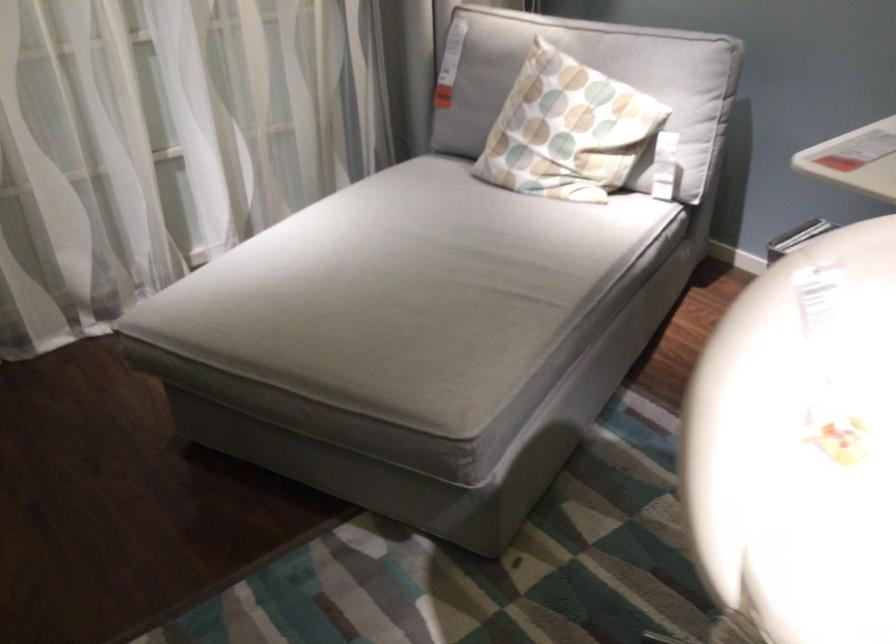
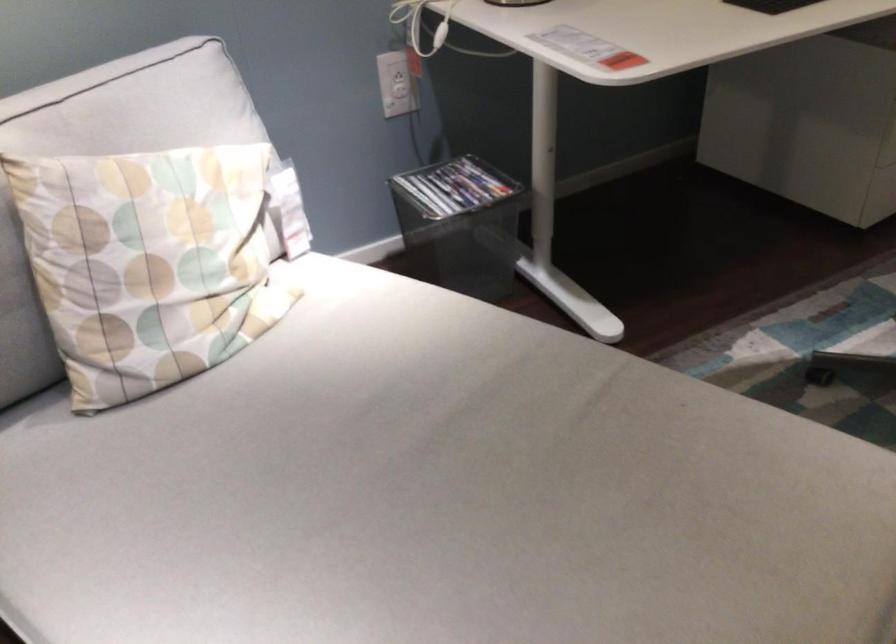
The point at (540,118) is marked in the first image. Where is the corresponding point in the second image?

(149, 263)